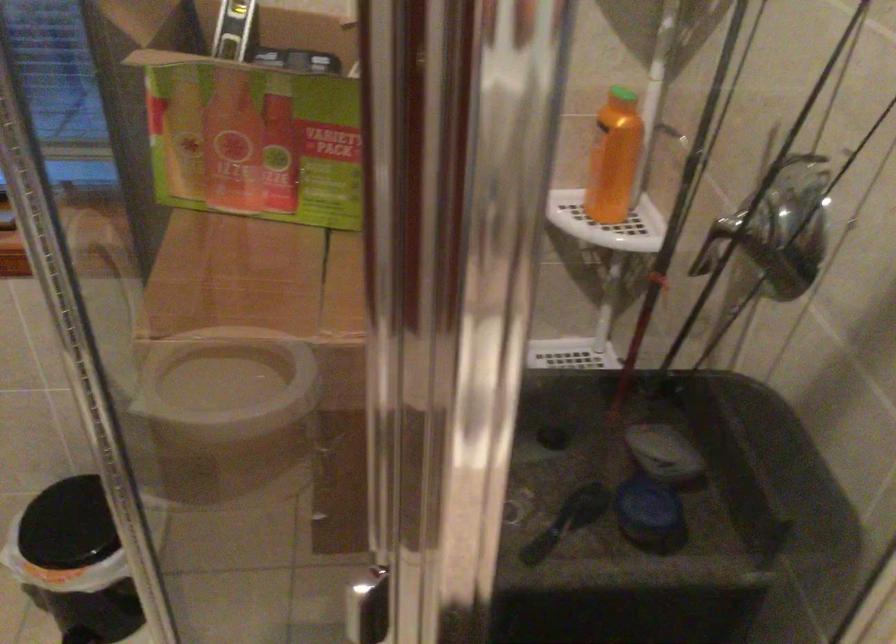
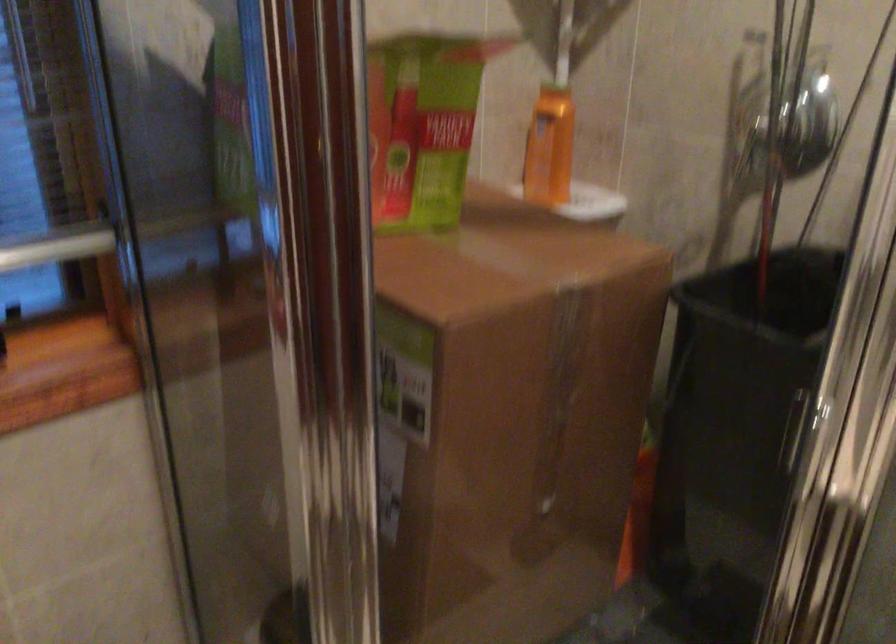
Question: The first image is from the beginning of the video and the second image is from the end. How did the camera likely rotate when shooting the video?

Choices:
 (A) Left
 (B) Right
 (C) Up
 (D) Down

Answer: (B)